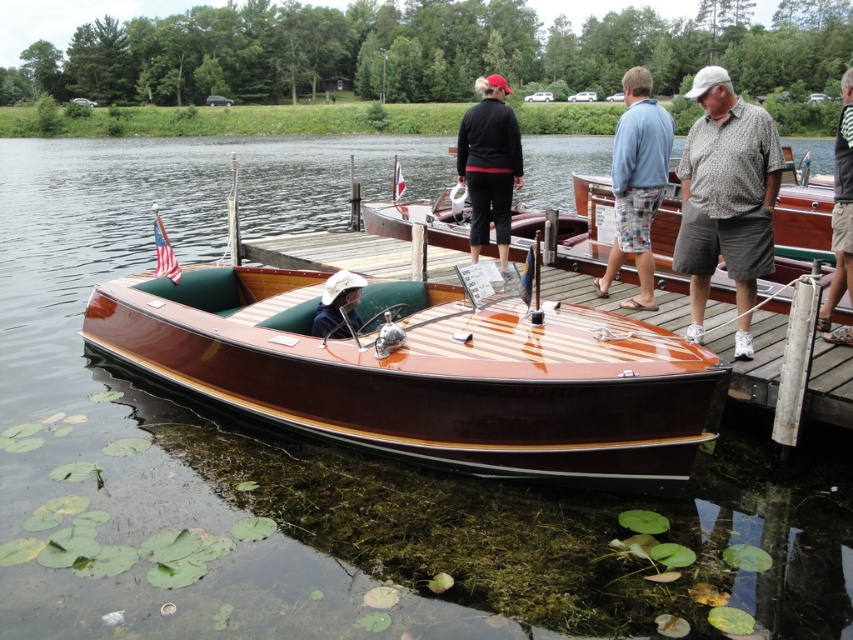
You are a photographer trying to capture a group photo of the people on the pier. You notice the black matte jacket at upper center and the gray striped shirt at right. Which person should you focus on to ensure they appear larger in the photo?

The gray striped shirt at right should be focused on because the black matte jacket at upper center occupies less space, meaning the person in the gray striped shirt is larger and will appear bigger in the photo.